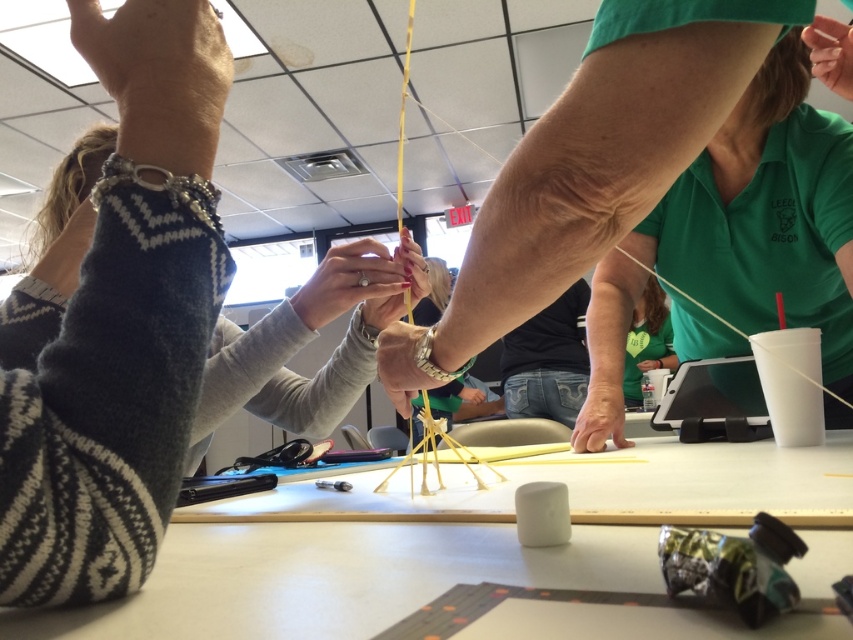
Looking at this image, who is more forward, (202,595) or (547,248)?

Positioned in front is point (202,595).

Is point (247, 499) closer to camera compared to point (556, 154)?

No, (247, 499) is further to viewer.

Find the location of a particular element. The image size is (853, 640). white matte table at center is located at coordinates (337, 577).

Is the position of smooth skin at upper right more distant than that of green fabric hand at center?

No, smooth skin at upper right is in front of green fabric hand at center.

Which is below, smooth skin at upper right or green fabric hand at center?

green fabric hand at center is lower down.

Image resolution: width=853 pixels, height=640 pixels. Describe the element at coordinates (830, 52) in the screenshot. I see `smooth skin at upper right` at that location.

Find the location of a particular element. smooth skin at upper right is located at coordinates (830, 52).

Between point (810, 32) and point (91, 90), which one is positioned in front?

Point (810, 32) is in front.

Is smooth skin at upper right shorter than smooth skin hand at upper left?

No.

Is point (851, 90) more distant than point (111, 106)?

No, (851, 90) is closer to viewer.

This screenshot has height=640, width=853. Identify the location of smooth skin at upper right. (830, 52).